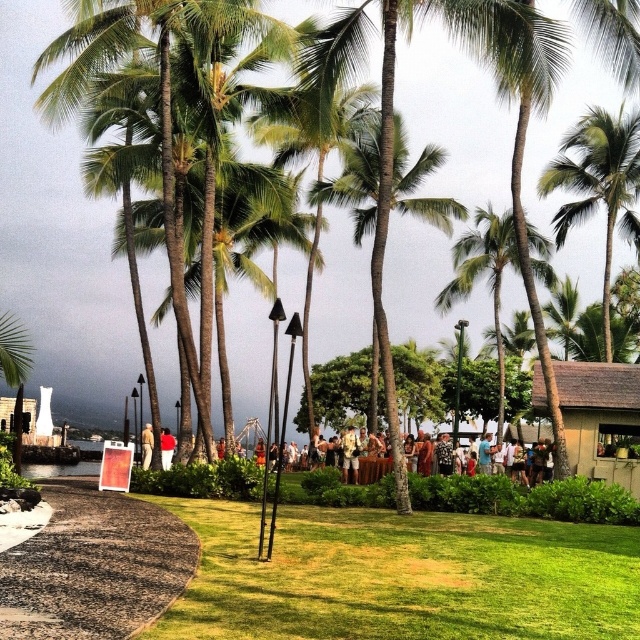
You are planning to take a photo of the crowd in the midground. To ensure both the green leafy palm tree at upper right and the green leafy palm tree at center are visible in the frame, which palm tree should you position closer to the camera?

To include both the green leafy palm tree at upper right and the green leafy palm tree at center in the photo, position the green leafy palm tree at upper right closer to the camera since it is in front of the one at center.